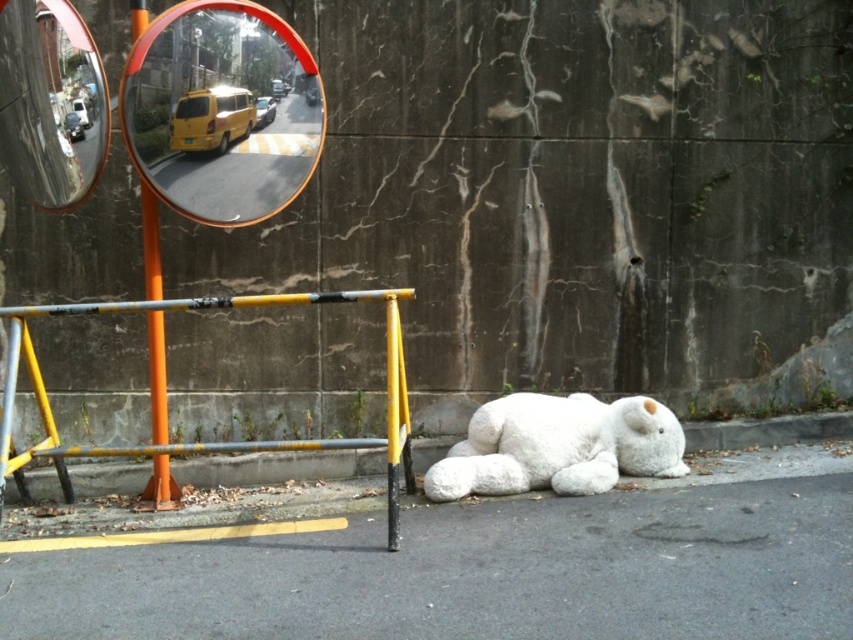
You are a pedestrian standing at the point indicated by the coordinates point (221,109). Looking around, you see the large white teddy bear on the pavement and the yellow and black metal barrier. Which object is closer to your current position?

The point (221,109) indicates the orange reflective convex mirror at upper left, so you are at the orange reflective convex mirror at upper left. The yellow and black metal barrier is closer to your current position than the large white teddy bear on the pavement.

You are a delivery robot with a 1 meter wide package. You need to navigate between the metallic mirror at upper left and the yellow metal barricade at lower center to reach the delivery point. Can you safely pass through the space between them?

The distance between the metallic mirror at upper left and the yellow metal barricade at lower center is 98.64 centimeters. Since your package is 1 meter wide, it is slightly wider than the available space. Therefore, you cannot safely pass through the space between them.

You are a pedestrian standing in the middle of the road looking at the orange reflective convex mirror at upper left and the orange plastic pole at left. Which object is nearer to you?

The orange reflective convex mirror at upper left is closer to the viewer than the orange plastic pole at left.